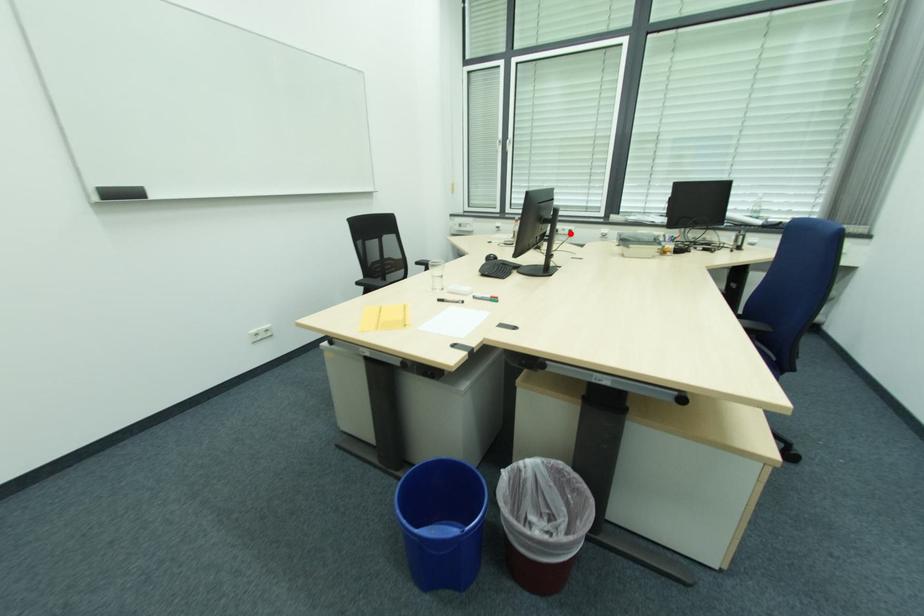
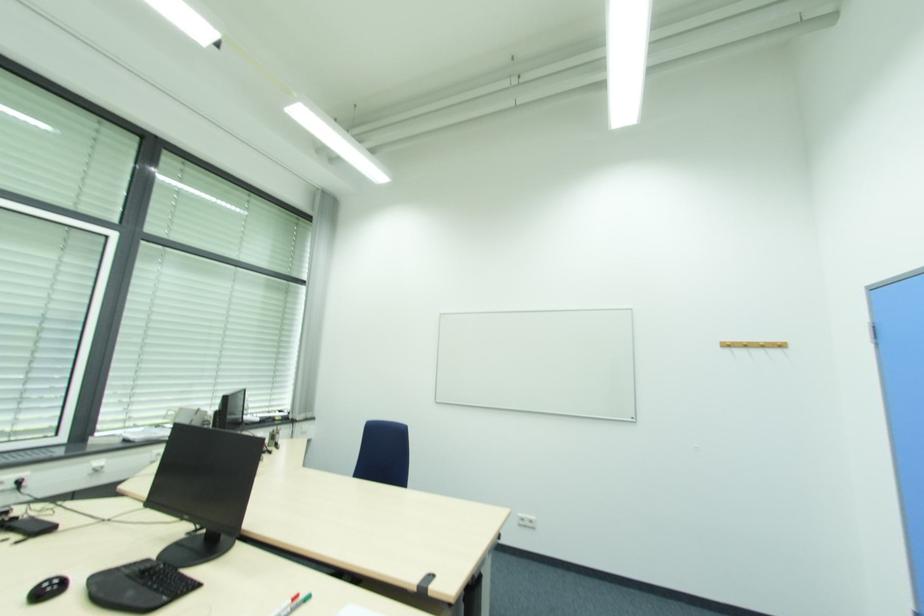
Question: I am providing you with two images of the same scene from different viewpoints. A red point is marked on the first image. At the location where the point appears in image 1, is it still visible in image 2?

Choices:
 (A) Yes
 (B) No

Answer: (A)